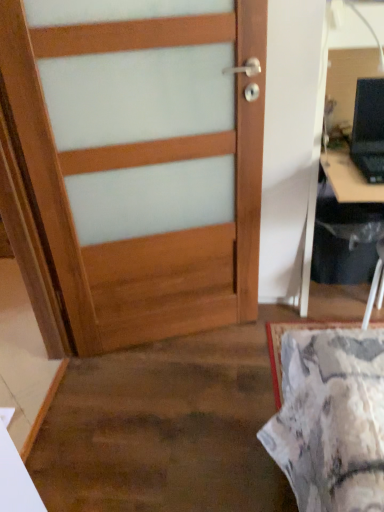
Measure the distance between black plastic computer desk at right and camera.

A distance of 1.51 meters exists between black plastic computer desk at right and camera.

What do you see at coordinates (336, 119) in the screenshot? The image size is (384, 512). I see `black plastic computer desk at right` at bounding box center [336, 119].

Where is `wooden door at center`? This screenshot has width=384, height=512. wooden door at center is located at coordinates (139, 163).

Which is more distant, (10,26) or (380,100)?

The point (380,100) is farther.

From the image's perspective, relative to black plastic laptop at upper right, is wooden door at center above or below?

Based on their image positions, wooden door at center is located beneath black plastic laptop at upper right.

How different are the orientations of wooden door at center and black plastic laptop at upper right in degrees?

The angle between the facing direction of wooden door at center and the facing direction of black plastic laptop at upper right is 19.5 degrees.

From a real-world perspective, is wooden door at center physically located above or below black plastic laptop at upper right?

In terms of real-world spatial position, wooden door at center is below black plastic laptop at upper right.

Is black plastic computer desk at right smaller than wooden door at center?

Actually, black plastic computer desk at right might be larger than wooden door at center.

Who is taller, black plastic computer desk at right or wooden door at center?

Standing taller between the two is wooden door at center.

From the image's perspective, is black plastic computer desk at right located above or below wooden door at center?

black plastic computer desk at right is above wooden door at center.

Is wooden door at center to the left of black plastic computer desk at right from the viewer's perspective?

Indeed, wooden door at center is positioned on the left side of black plastic computer desk at right.

I want to click on computer desk lying on the right of wooden door at center, so click(336, 119).

Is wooden door at center facing towards black plastic computer desk at right?

No, wooden door at center is not aimed at black plastic computer desk at right.

Is wooden door at center far away from black plastic computer desk at right?

No, wooden door at center is not far away from black plastic computer desk at right.

Can you tell me how much black plastic laptop at upper right and wooden door at center differ in facing direction?

The facing directions of black plastic laptop at upper right and wooden door at center are 19.5 degrees apart.

Which of these two, black plastic laptop at upper right or wooden door at center, stands taller?

wooden door at center is taller.

From a real-world perspective, is black plastic laptop at upper right physically below wooden door at center?

No, from a real-world perspective, black plastic laptop at upper right is not below wooden door at center.

Is wooden door at center located within black plastic laptop at upper right?

No, wooden door at center is not surrounded by black plastic laptop at upper right.

Is black plastic laptop at upper right far from black plastic computer desk at right?

No, black plastic laptop at upper right is not far from black plastic computer desk at right.

Does black plastic laptop at upper right turn towards black plastic computer desk at right?

Yes, black plastic laptop at upper right is aimed at black plastic computer desk at right.

Between black plastic laptop at upper right and black plastic computer desk at right, which one has larger width?

With larger width is black plastic computer desk at right.

Considering the sizes of black plastic computer desk at right and black plastic laptop at upper right in the image, is black plastic computer desk at right bigger or smaller than black plastic laptop at upper right?

In the image, black plastic computer desk at right appears to be larger than black plastic laptop at upper right.

Is black plastic computer desk at right not within black plastic laptop at upper right?

Yes, black plastic computer desk at right is located beyond the bounds of black plastic laptop at upper right.

How many degrees apart are the facing directions of black plastic computer desk at right and black plastic laptop at upper right?

There is a 0.7-degree angle between the facing directions of black plastic computer desk at right and black plastic laptop at upper right.

Does point (348, 63) appear closer or farther from the camera than point (362, 97)?

Point (348, 63) is positioned farther from the camera compared to point (362, 97).

Identify the location of door that appears below the black plastic laptop at upper right (from the image's perspective). (139, 163).

Identify the location of door that is behind the black plastic computer desk at right. (139, 163).

Based on their spatial positions, is wooden door at center or black plastic computer desk at right further from black plastic laptop at upper right?

wooden door at center.

When comparing their distances from black plastic laptop at upper right, does black plastic computer desk at right or wooden door at center seem further?

wooden door at center is positioned further to the anchor black plastic laptop at upper right.

Which object lies further to the anchor point wooden door at center, black plastic computer desk at right or black plastic laptop at upper right?

Based on the image, black plastic laptop at upper right appears to be further to wooden door at center.

When comparing their distances from black plastic computer desk at right, does black plastic laptop at upper right or wooden door at center seem closer?

The object closer to black plastic computer desk at right is black plastic laptop at upper right.

In the scene shown: Estimate the real-world distances between objects in this image. Which object is further from wooden door at center, black plastic laptop at upper right or black plastic computer desk at right?

black plastic laptop at upper right lies further to wooden door at center than the other object.

Based on their spatial positions, is wooden door at center or black plastic laptop at upper right further from black plastic computer desk at right?

Among the two, wooden door at center is located further to black plastic computer desk at right.

Locate an element on the screen. laptop between wooden door at center and black plastic computer desk at right from left to right is located at coordinates (369, 129).